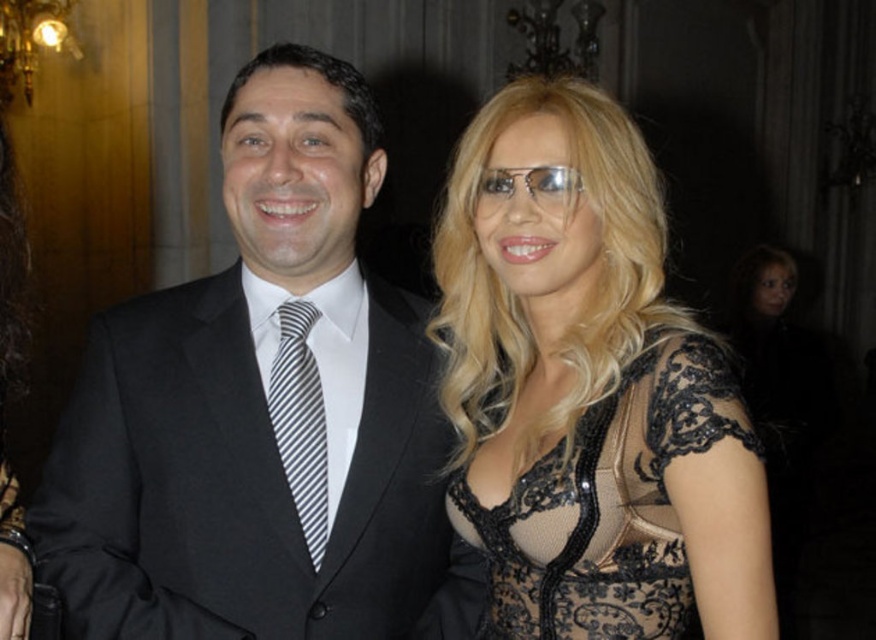
Is black lace dress at upper right below striped fabric tie at center?

Indeed, black lace dress at upper right is positioned under striped fabric tie at center.

Is black lace dress at upper right shorter than striped fabric tie at center?

Yes.

You are a GUI agent. You are given a task and a screenshot of the screen. Output one action in this format:
    pyautogui.click(x=<x>, y=<y>)
    Task: Click on the black lace dress at upper right
    
    Given the screenshot: What is the action you would take?
    pyautogui.click(x=611, y=502)

Who is higher up, black satin suit at center or black lace dress at upper right?

black satin suit at center is above.

I want to click on black satin suit at center, so click(x=263, y=412).

Is the position of black satin suit at center more distant than that of striped fabric tie at center?

No, black satin suit at center is closer to the viewer.

Can you confirm if black satin suit at center is positioned below striped fabric tie at center?

No, black satin suit at center is not below striped fabric tie at center.

Who is more distant from viewer, (478, 602) or (320, 528)?

The point (478, 602) is behind.

The height and width of the screenshot is (640, 876). In order to click on black satin suit at center in this screenshot , I will do `click(263, 412)`.